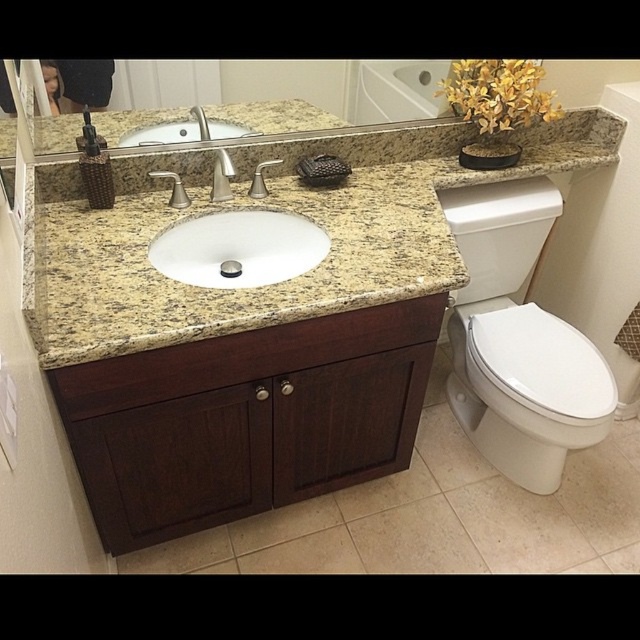
You are a plumber inspecting the bathroom setup. You need to locate the faucet to check for leaks. According to the image, where is the satin nickel faucet at center in relation to the white glossy sink at center?

The satin nickel faucet at center is above the white glossy sink at center.

You are standing in front of the bathroom vanity. You want to clean the satin nickel faucet at center but first need to reach the white glossy sink at center. Which object should you clean first based on their positions?

The white glossy sink at center is closer to you than the satin nickel faucet at center, so you should clean the white glossy sink at center first.